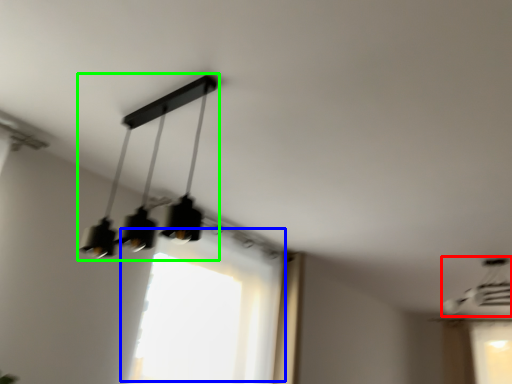
Question: Based on their relative distances, which object is nearer to lamp (highlighted by a red box)? Choose from window (highlighted by a blue box) and lamp (highlighted by a green box).

Choices:
 (A) window
 (B) lamp

Answer: (A)